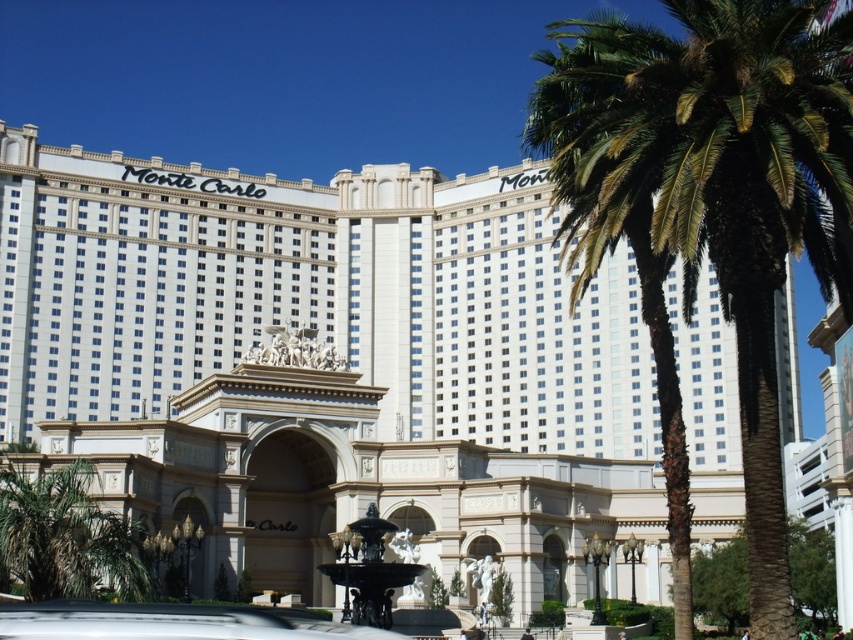
Can you confirm if white glossy building at center is smaller than green leafy palm at right?

Correct, white glossy building at center occupies less space than green leafy palm at right.

Which of these two, white glossy building at center or green leafy palm at right, stands taller?

Standing taller between the two is green leafy palm at right.

Where is `white glossy building at center`? This screenshot has height=640, width=853. white glossy building at center is located at coordinates (312, 296).

Between point (67, 380) and point (341, 573), which one is positioned in front?

Point (341, 573) is in front.

Identify the location of white glossy building at center. The height and width of the screenshot is (640, 853). (312, 296).

Can you confirm if green leafy palm at right is taller than black polished stone fountain at center?

Yes, green leafy palm at right is taller than black polished stone fountain at center.

Does green leafy palm at right come behind black polished stone fountain at center?

No, green leafy palm at right is closer to the viewer.

This screenshot has height=640, width=853. Identify the location of green leafy palm at right. (x=712, y=188).

Locate an element on the screen. green leafy palm at right is located at coordinates (712, 188).